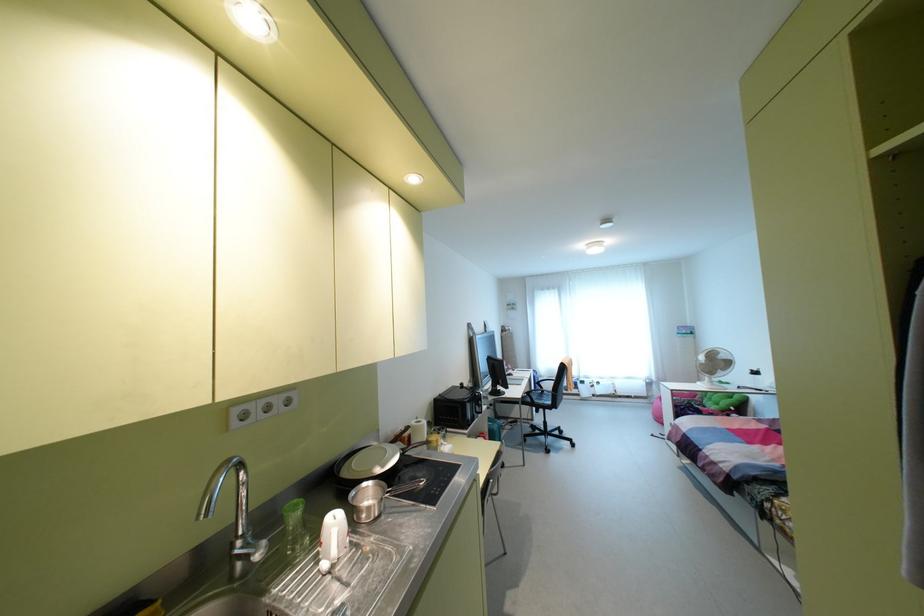
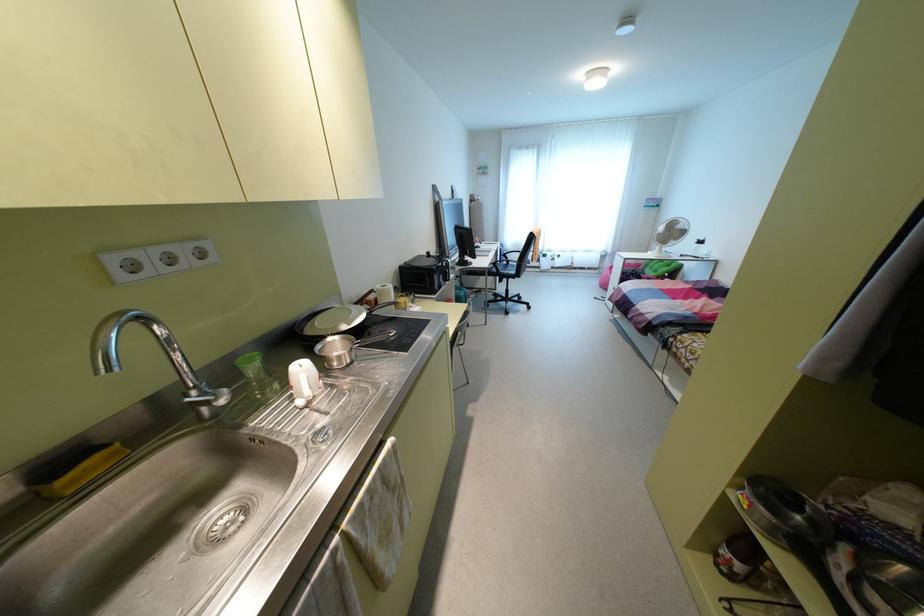
Where in the second image is the point corresponding to [420,487] from the first image?

(392, 339)